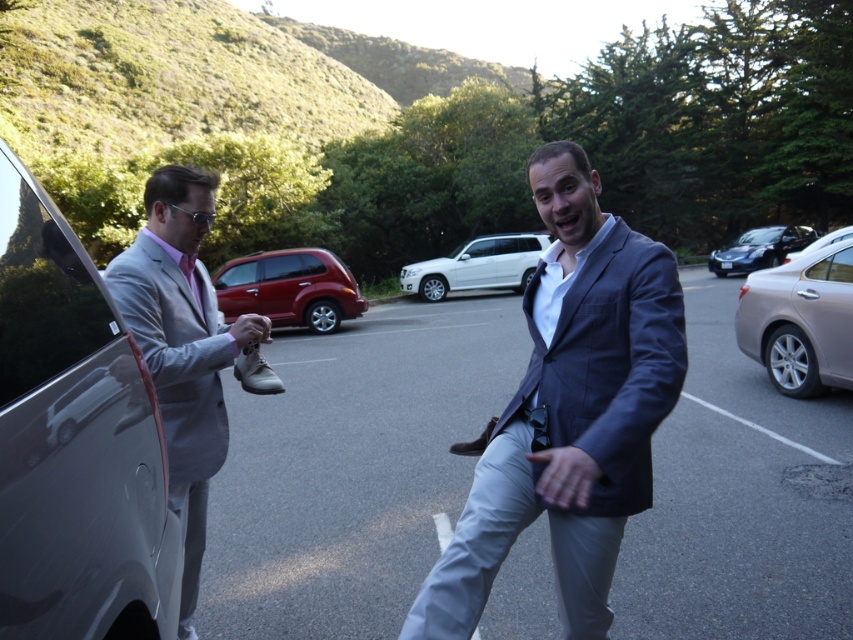
Question: Is matte blue blazer at center below white leather shoe at lower center?

Choices:
 (A) yes
 (B) no

Answer: (A)

Question: Which point is farther to the camera?

Choices:
 (A) (363, 458)
 (B) (189, 280)
 (C) (61, 541)
 (D) (438, 269)

Answer: (D)

Question: Estimate the real-world distances between objects in this image. Which object is farther from the matte black shoe at center?

Choices:
 (A) satin silver sedan at center
 (B) white leather shoe at lower center
 (C) matte gray shoe at center

Answer: (A)

Question: Is silver metallic minivan at left to the right of satin silver sedan at center from the viewer's perspective?

Choices:
 (A) yes
 (B) no

Answer: (B)

Question: Is matte blue blazer at center below shiny black sedan at center?

Choices:
 (A) yes
 (B) no

Answer: (A)

Question: Among these points, which one is nearest to the camera?

Choices:
 (A) (648, 483)
 (B) (349, 586)

Answer: (A)